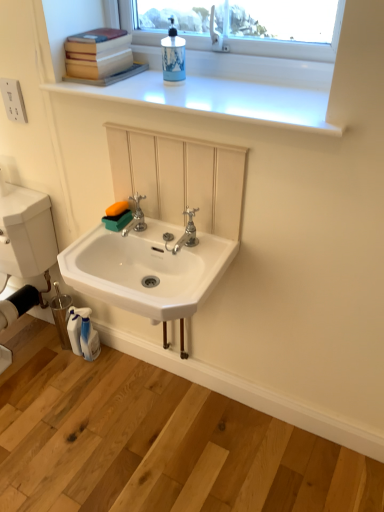
Where is `free space above white glossy sink at lower center (from a real-world perspective)`? free space above white glossy sink at lower center (from a real-world perspective) is located at coordinates (127, 423).